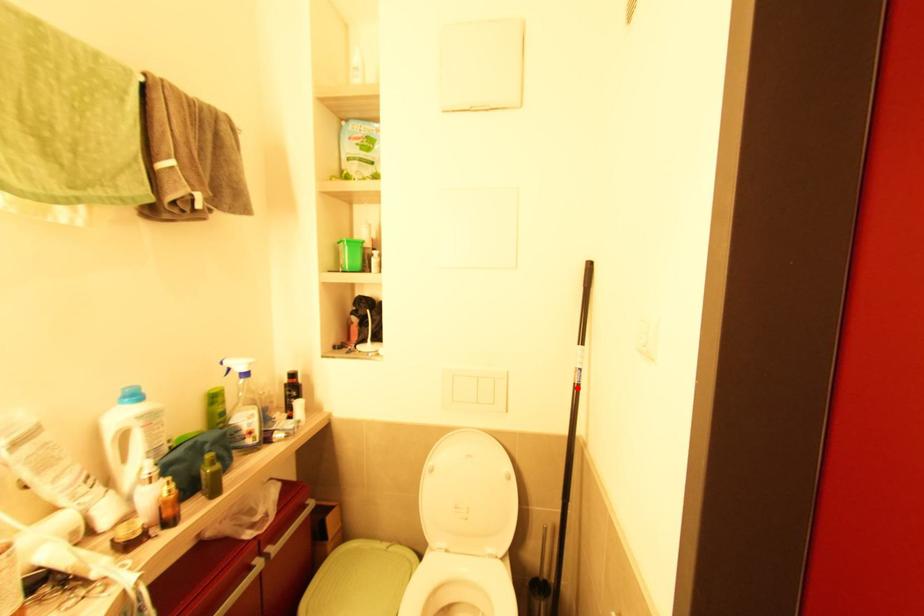
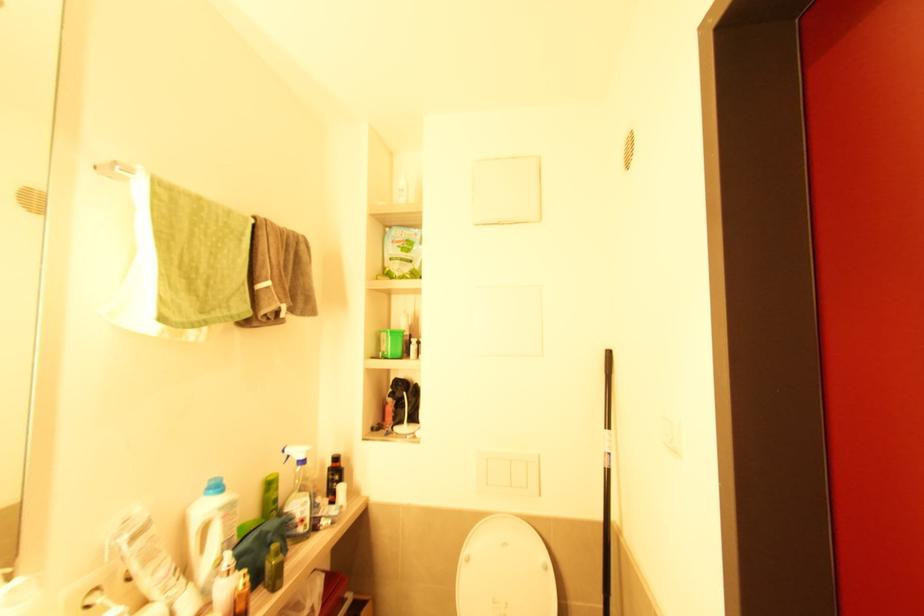
In the second image, find the point that corresponds to the highlighted location in the first image.

(610, 472)